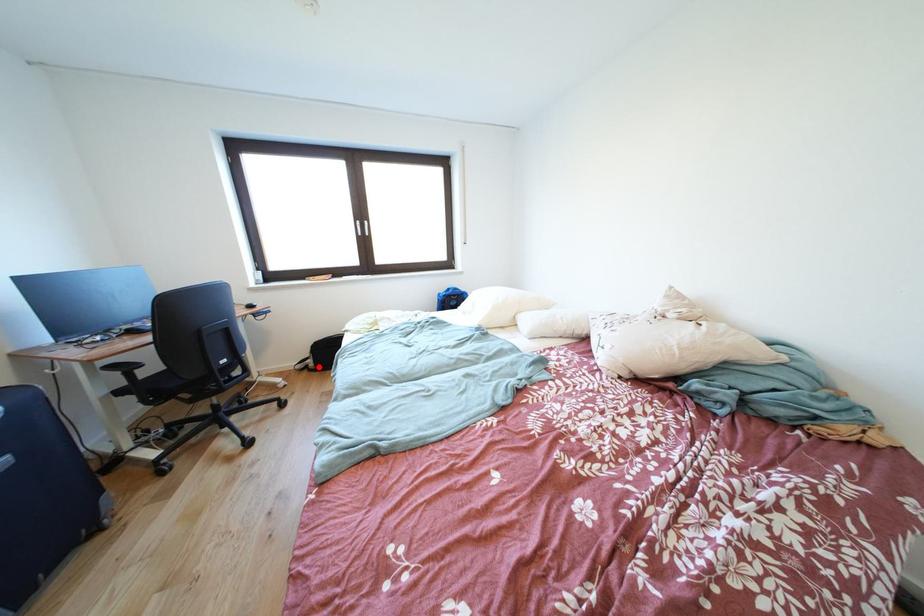
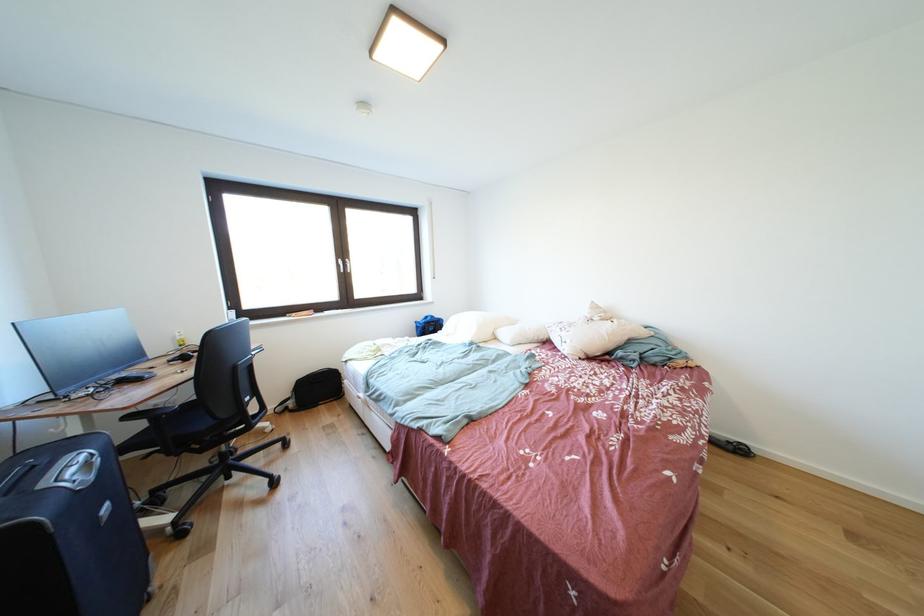
Find the pixel in the second image that matches the highlighted location in the first image.

(299, 408)